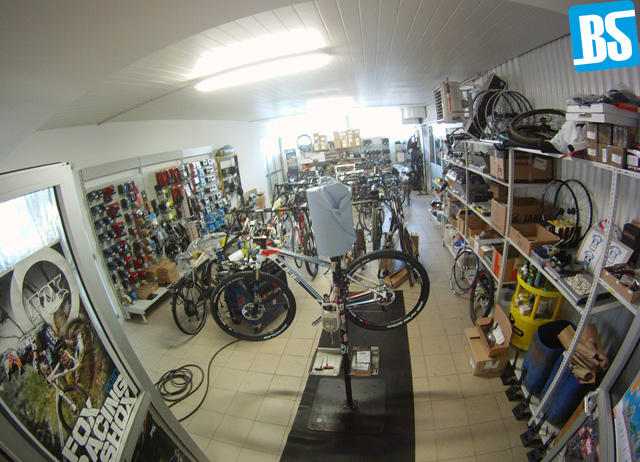
The width and height of the screenshot is (640, 462). Find the location of `poster`. poster is located at coordinates (86, 377).